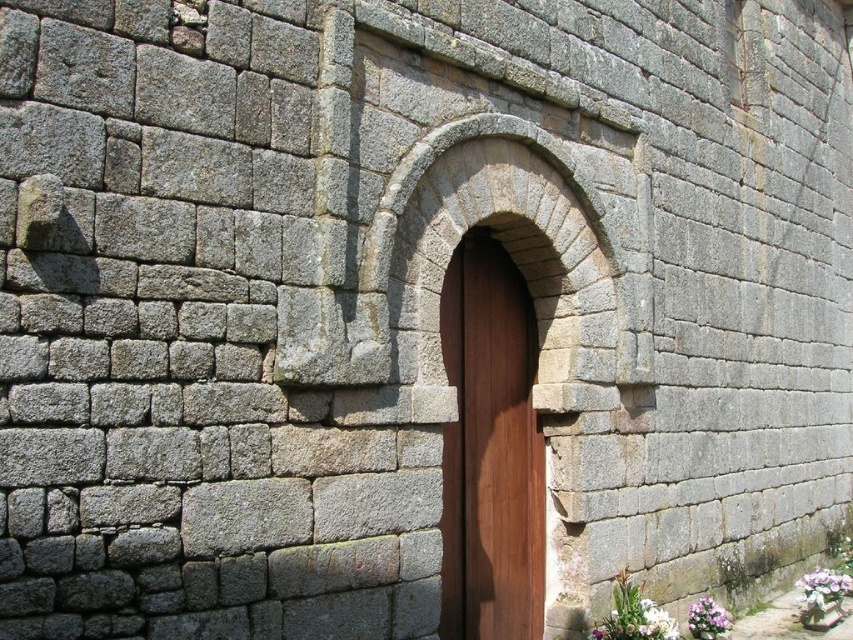
Question: Which of the following is the closest to the observer?

Choices:
 (A) (639, 634)
 (B) (613, 602)

Answer: (A)

Question: Estimate the real-world distances between objects in this image. Which object is farther from the brown wooden door at center?

Choices:
 (A) white matte flower at lower right
 (B) purple fabric flower at lower right

Answer: (B)

Question: In this image, where is brown wooden door at center located relative to white matte flowers at lower right?

Choices:
 (A) right
 (B) left

Answer: (B)

Question: Can you confirm if brown wooden door at center is wider than purple fabric flower at lower right?

Choices:
 (A) yes
 (B) no

Answer: (A)

Question: Can you confirm if brown wooden door at center is bigger than white matte flowers at lower right?

Choices:
 (A) yes
 (B) no

Answer: (A)

Question: Among these points, which one is nearest to the camera?

Choices:
 (A) (650, 624)
 (B) (651, 636)
 (C) (485, 369)

Answer: (B)